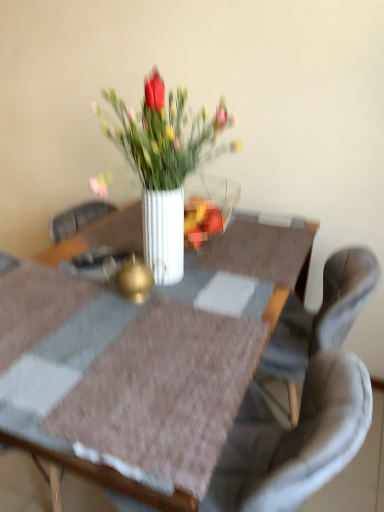
Question: Does gray fabric chair at center come behind white glossy vase at center?

Choices:
 (A) no
 (B) yes

Answer: (A)

Question: Considering the relative sizes of gray fabric chair at center and white glossy vase at center in the image provided, is gray fabric chair at center wider than white glossy vase at center?

Choices:
 (A) yes
 (B) no

Answer: (A)

Question: From the image's perspective, would you say gray fabric chair at center is positioned over white glossy vase at center?

Choices:
 (A) no
 (B) yes

Answer: (A)

Question: Is gray fabric chair at center taller than white glossy vase at center?

Choices:
 (A) no
 (B) yes

Answer: (B)

Question: Can you confirm if gray fabric chair at center is bigger than white glossy vase at center?

Choices:
 (A) no
 (B) yes

Answer: (B)

Question: Is gray fabric chair at center in contact with white glossy vase at center?

Choices:
 (A) no
 (B) yes

Answer: (A)

Question: From the image's perspective, is white glossy vase at center on white glossy vase at center?

Choices:
 (A) yes
 (B) no

Answer: (A)

Question: Can you confirm if white glossy vase at center is thinner than white glossy vase at center?

Choices:
 (A) yes
 (B) no

Answer: (A)

Question: From the image's perspective, does white glossy vase at center appear lower than white glossy vase at center?

Choices:
 (A) no
 (B) yes

Answer: (A)

Question: Can you confirm if white glossy vase at center is positioned to the right of white glossy vase at center?

Choices:
 (A) no
 (B) yes

Answer: (B)

Question: From a real-world perspective, does white glossy vase at center stand above white glossy vase at center?

Choices:
 (A) no
 (B) yes

Answer: (B)

Question: Is white glossy vase at center facing away from white glossy vase at center?

Choices:
 (A) no
 (B) yes

Answer: (A)

Question: Is white glossy vase at center to the right of white glossy vase at center from the viewer's perspective?

Choices:
 (A) no
 (B) yes

Answer: (A)